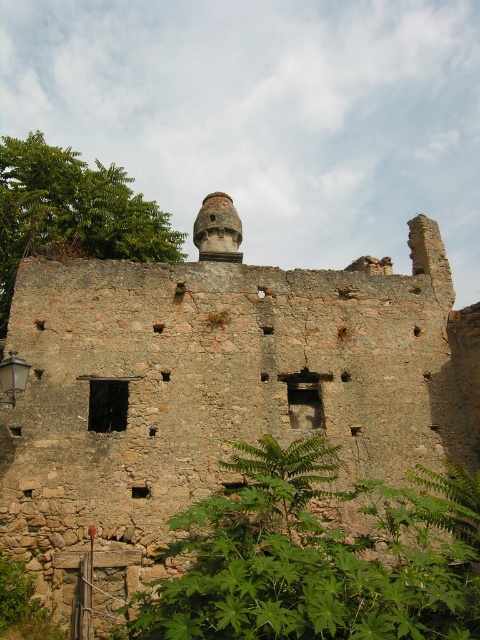
Is green leafy plant at lower center below green leafy foliage at upper left?

Yes.

Does green leafy plant at lower center have a greater height compared to green leafy foliage at upper left?

Incorrect, green leafy plant at lower center's height is not larger of green leafy foliage at upper left's.

Which is behind, point (315, 637) or point (7, 177)?

The point (7, 177) is behind.

Where is `green leafy plant at lower center`? The image size is (480, 640). green leafy plant at lower center is located at coordinates coord(315,557).

Who is positioned more to the left, rustic stone ruins at center or green leafy plant at lower center?

rustic stone ruins at center

Consider the image. Between rustic stone ruins at center and green leafy plant at lower center, which one has more height?

rustic stone ruins at center is taller.

Where is `rustic stone ruins at center`? This screenshot has width=480, height=640. rustic stone ruins at center is located at coordinates (216, 387).

You are a GUI agent. You are given a task and a screenshot of the screen. Output one action in this format:
    pyautogui.click(x=<x>, y=<y>)
    Task: Click on the rustic stone ruins at center
    Image resolution: width=480 pixels, height=640 pixels.
    Given the screenshot: What is the action you would take?
    pyautogui.click(x=216, y=387)

Is rustic stone ruins at center above green leafy foliage at upper left?

Actually, rustic stone ruins at center is below green leafy foliage at upper left.

Is rustic stone ruins at center smaller than green leafy foliage at upper left?

Yes.

Measure the distance between point (117, 365) and camera.

A distance of 138.30 feet exists between point (117, 365) and camera.

Find the location of a particular element. Image resolution: width=480 pixels, height=640 pixels. rustic stone ruins at center is located at coordinates (216, 387).